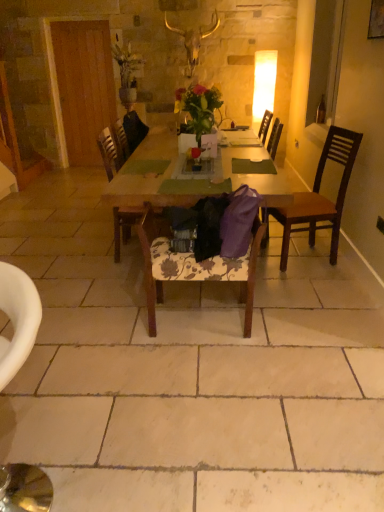
The image size is (384, 512). What are the coordinates of `vacant space in front of brown wooden chair at right, positioned as the third chair in front-to-back order` in the screenshot? It's located at (312, 283).